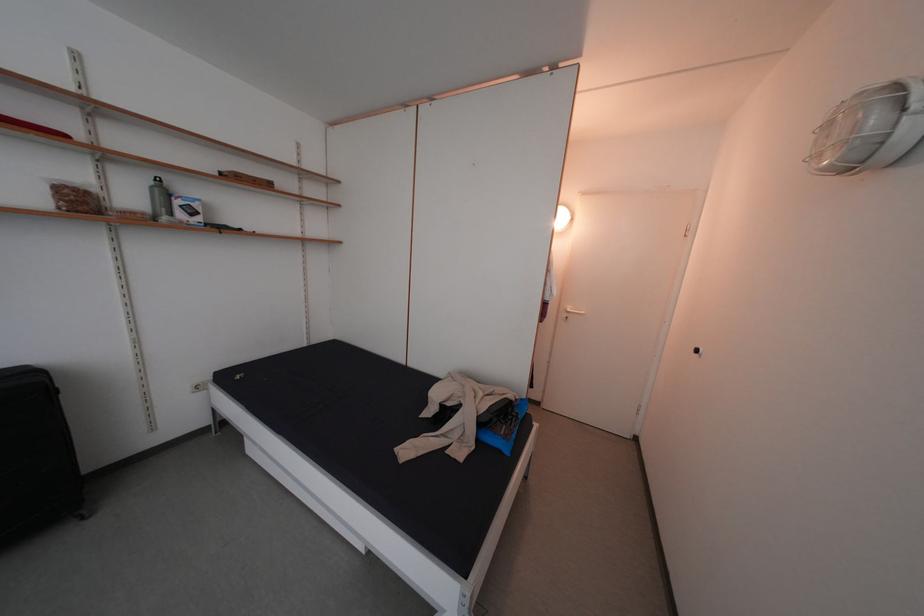
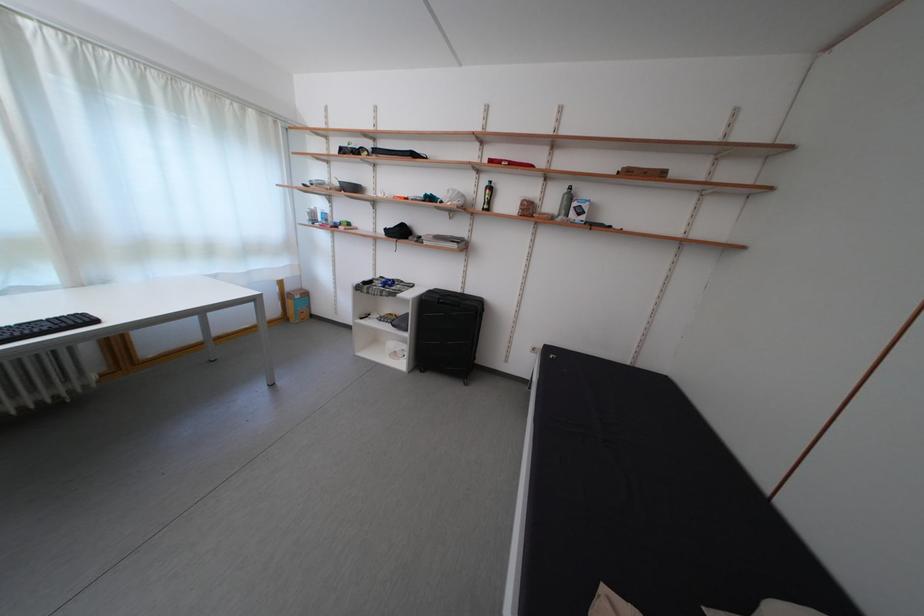
Question: The camera is either moving clockwise (left) or counter-clockwise (right) around the object. The first image is from the beginning of the video and the second image is from the end. Is the camera moving left or right when shooting the video?

Choices:
 (A) Left
 (B) Right

Answer: (B)